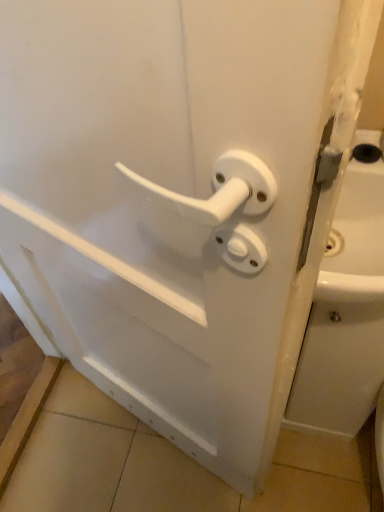
Where is `white glossy sink at right`? The width and height of the screenshot is (384, 512). white glossy sink at right is located at coordinates (345, 313).

The image size is (384, 512). What do you see at coordinates (345, 313) in the screenshot? I see `white glossy sink at right` at bounding box center [345, 313].

Find the location of a particular element. The image size is (384, 512). white glossy sink at right is located at coordinates (345, 313).